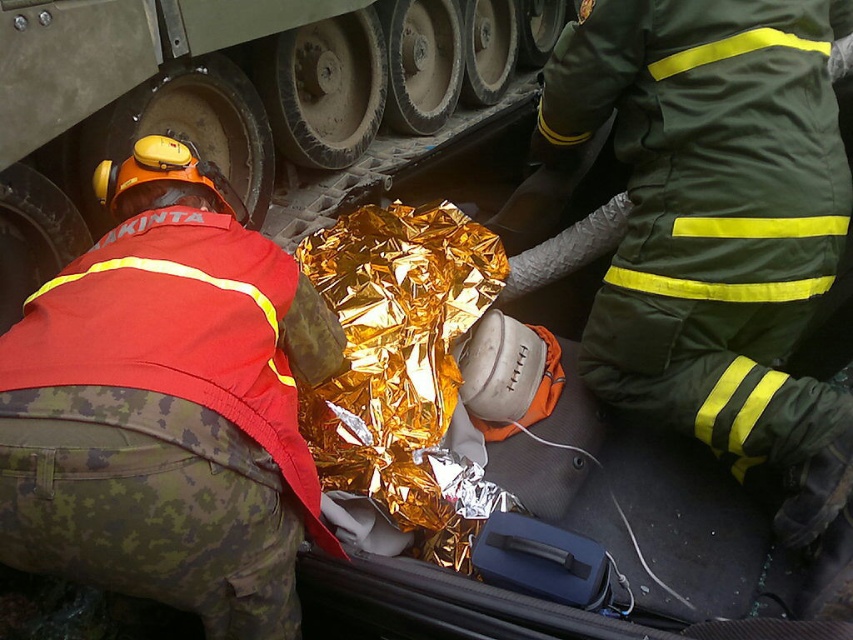
Can you confirm if green matte uniform at center is positioned to the left of metallic gray tank track at center?

Incorrect, green matte uniform at center is not on the left side of metallic gray tank track at center.

Looking at this image, who is taller, green matte uniform at center or metallic gray tank track at center?

With more height is metallic gray tank track at center.

What do you see at coordinates (717, 225) in the screenshot? This screenshot has height=640, width=853. I see `green matte uniform at center` at bounding box center [717, 225].

Identify the location of green matte uniform at center. (717, 225).

Is camouflage pants at lower left taller than metallic gray tank track at center?

No, camouflage pants at lower left is not taller than metallic gray tank track at center.

Is point (48, 307) behind point (514, 49)?

No, it is not.

You are a GUI agent. You are given a task and a screenshot of the screen. Output one action in this format:
    pyautogui.click(x=<x>, y=<y>)
    Task: Click on the camouflage pants at lower left
    
    Given the screenshot: What is the action you would take?
    pyautogui.click(x=167, y=406)

Does camouflage pants at lower left have a greater height compared to green matte uniform at center?

Incorrect, camouflage pants at lower left's height is not larger of green matte uniform at center's.

The width and height of the screenshot is (853, 640). Describe the element at coordinates (167, 406) in the screenshot. I see `camouflage pants at lower left` at that location.

This screenshot has height=640, width=853. I want to click on camouflage pants at lower left, so click(167, 406).